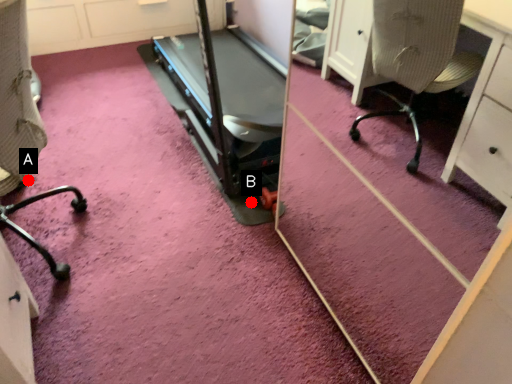
Question: Two points are circled on the image, labeled by A and B beside each circle. Among these points, which one is nearest to the camera?

Choices:
 (A) A is closer
 (B) B is closer

Answer: (A)